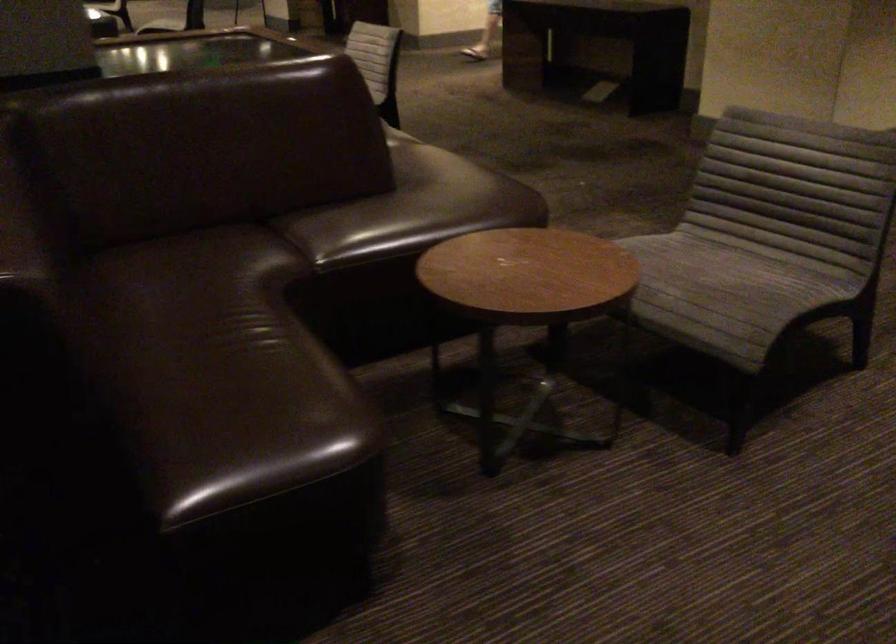
Identify the location of grey chair sitting surface. This screenshot has width=896, height=644. pyautogui.click(x=722, y=286).